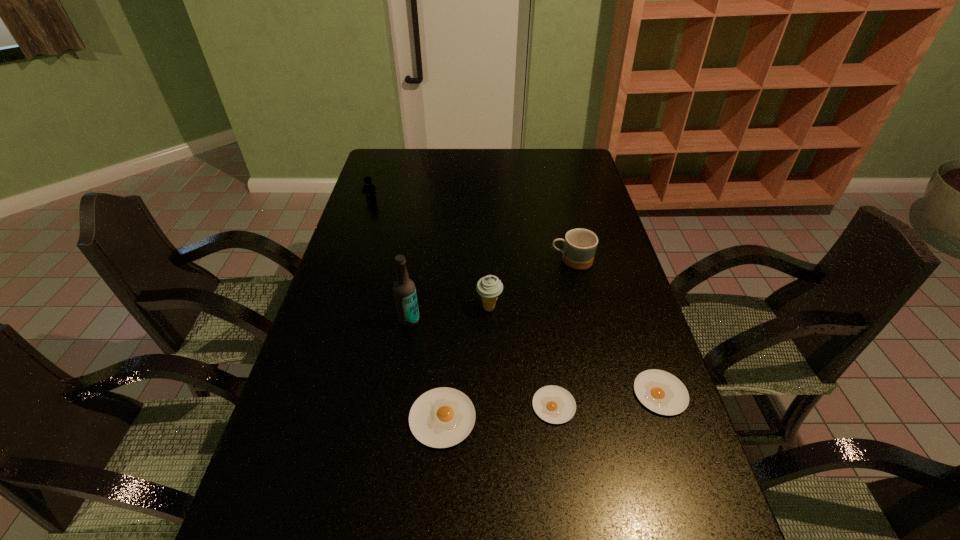
At what (x,y) coordinates should I click in order to perform the action: click on beer bottle. Please return your answer as a coordinate pair (x, y). This screenshot has height=540, width=960. Looking at the image, I should click on (404, 288).

At what (x,y) coordinates should I click in order to perform the action: click on the tallest object. Please return your answer as a coordinate pair (x, y). The image size is (960, 540). Looking at the image, I should click on (404, 288).

Locate an element on the screen. The width and height of the screenshot is (960, 540). free space located on the back of the tallest egg yolk is located at coordinates (451, 290).

At what (x,y) coordinates should I click in order to perform the action: click on vacant region located 0.190m on the left of the second egg yolk from right to left. Please return your answer as a coordinate pair (x, y). This screenshot has height=540, width=960. Looking at the image, I should click on (450, 406).

Identify the location of vacant area situated on the back of the sixth tallest object. (641, 336).

Identify the location of vacant area located 0.280m on the side with the handle of the second farthest object. (461, 261).

Identify the location of vacant area situated 0.150m on the side with the handle of the second farthest object. (502, 261).

Locate an element on the screen. The width and height of the screenshot is (960, 540). vacant space located on the side with the handle of the second farthest object is located at coordinates (461, 261).

Find the location of `vacant space situated 0.100m on the front-facing side of the leftmost object`. vacant space situated 0.100m on the front-facing side of the leftmost object is located at coordinates (365, 217).

This screenshot has height=540, width=960. I want to click on free space located on the left of the icecream, so click(x=335, y=308).